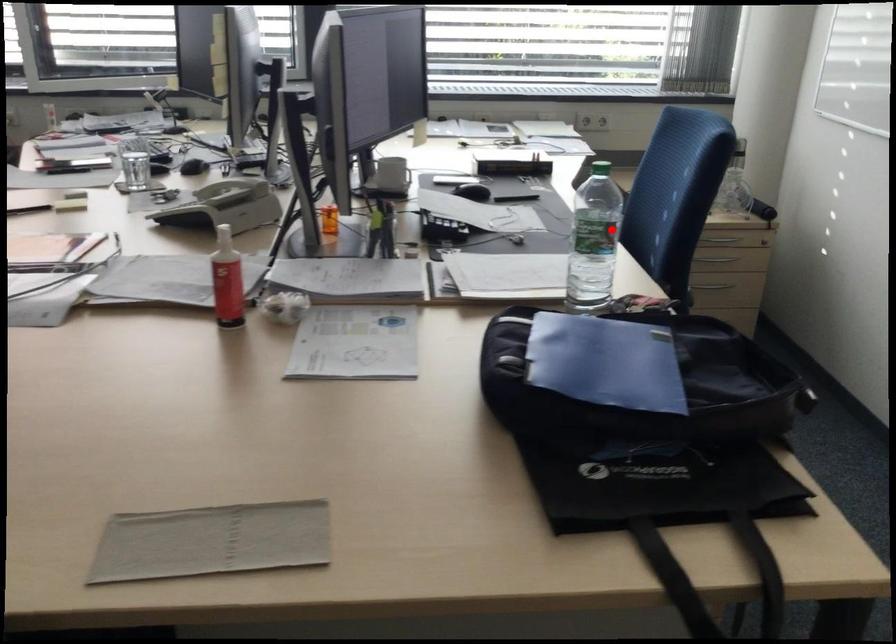
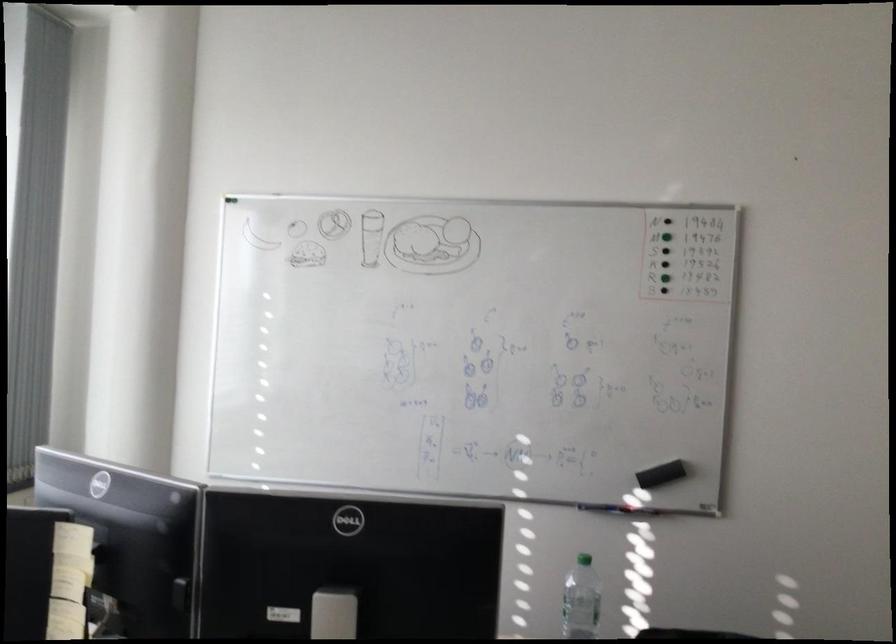
The point at the highlighted location is marked in the first image. Where is the corresponding point in the second image?

(581, 600)